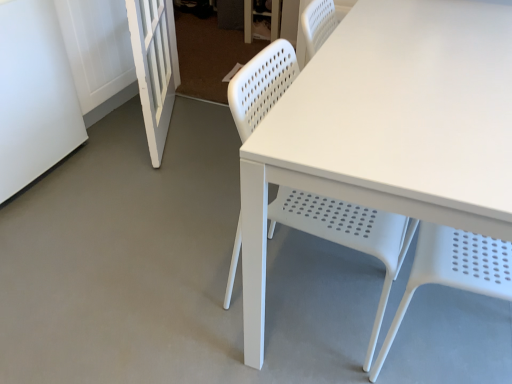
Identify the location of vacant region to the left of white plastic chair at center. (182, 289).